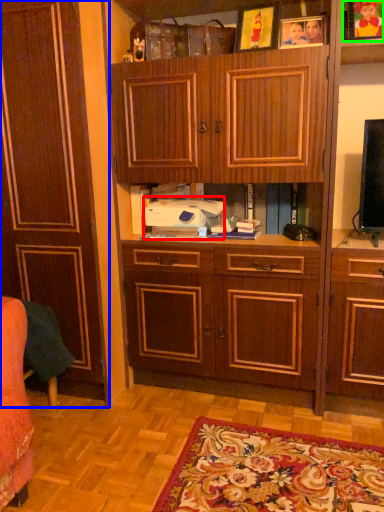
Question: Based on their relative distances, which object is farther from printer (highlighted by a red box)? Choose from cabinetry (highlighted by a blue box) and picture frame (highlighted by a green box).

Choices:
 (A) cabinetry
 (B) picture frame

Answer: (B)